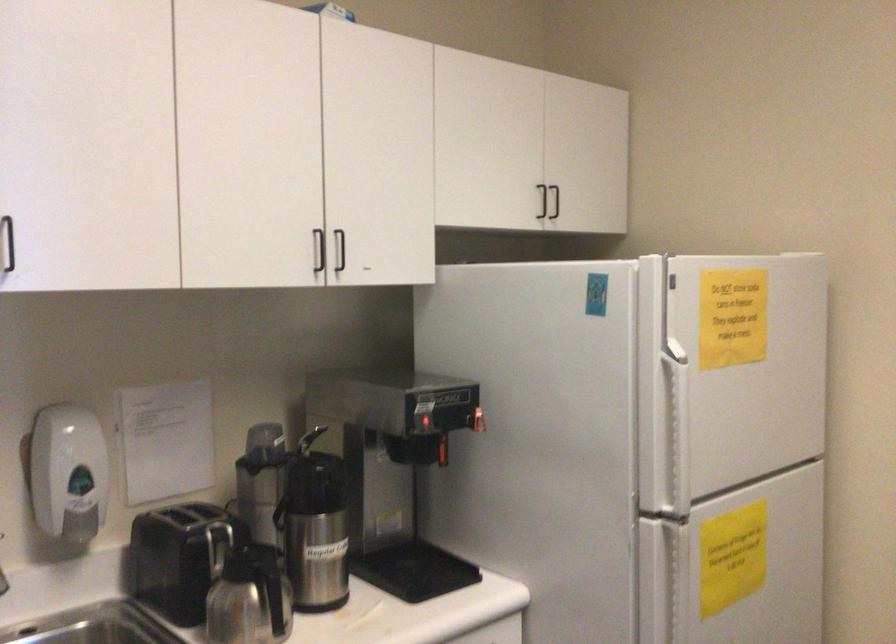
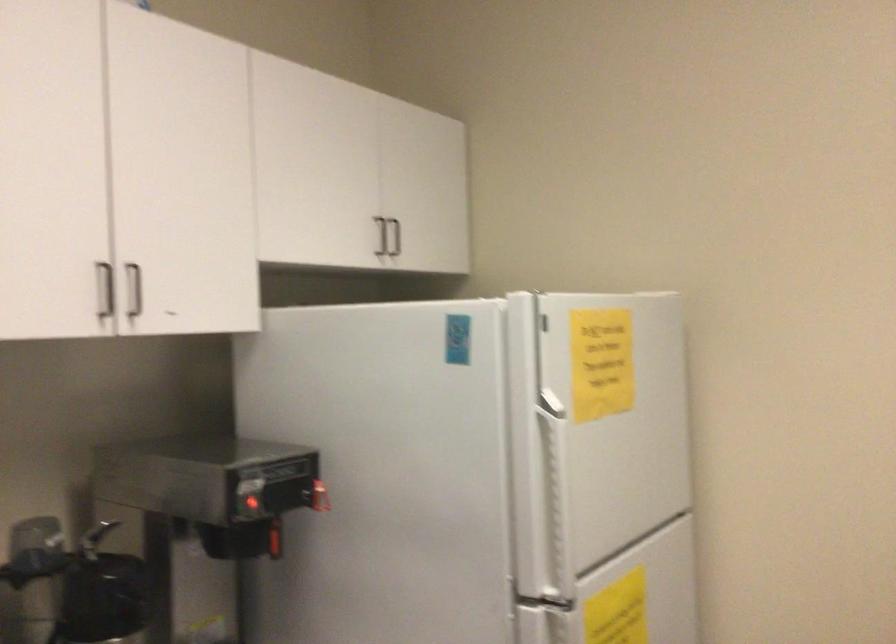
Where in the second image is the point corresponding to (x=560, y=200) from the first image?

(394, 237)